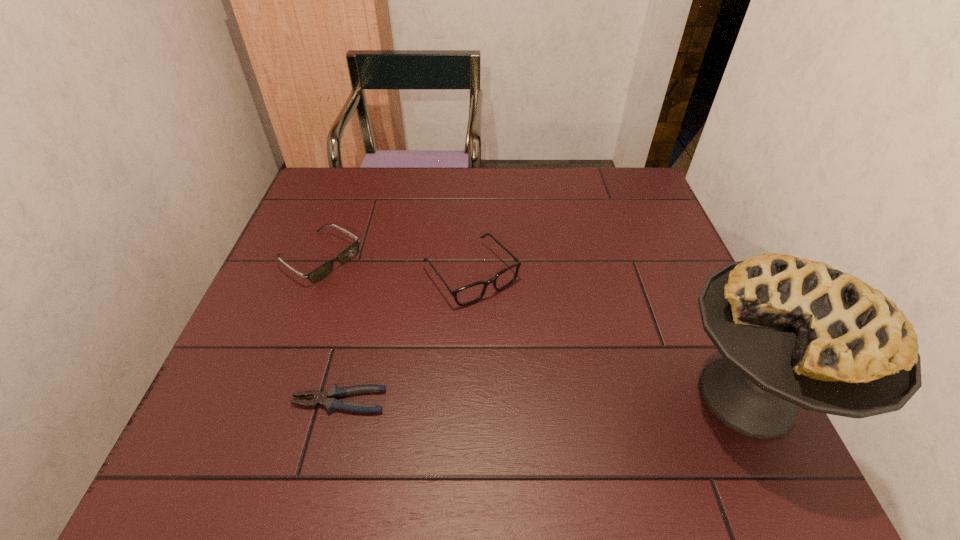
This screenshot has width=960, height=540. Identify the location of vacant region between the tallest object and the pliers. (543, 399).

Find the location of a particular element. This screenshot has width=960, height=540. the third closest object to the second tallest object is located at coordinates (792, 332).

Select which object is the third closest to the third shortest object. Please provide its 2D coordinates. Your answer should be formatted as a tuple, i.e. [(x, y)], where the tuple contains the x and y coordinates of a point satisfying the conditions above.

[(792, 332)]

Locate an element on the screen. Image resolution: width=960 pixels, height=540 pixels. free space that satisfies the following two spatial constraints: 1. on the front side of the third tallest object; 2. on the cut side of the rightmost object is located at coordinates (267, 397).

Locate an element on the screen. The image size is (960, 540). vacant space that satisfies the following two spatial constraints: 1. on the front side of the pie; 2. on the cut side of the sunglasses is located at coordinates (267, 397).

Identify the location of free space that satisfies the following two spatial constraints: 1. on the front side of the shortest object; 2. at the gripping part of the sunglasses. (265, 401).

Identify the location of vacant space that satisfies the following two spatial constraints: 1. on the front side of the third tallest object; 2. on the cut side of the tallest object. The image size is (960, 540). (267, 397).